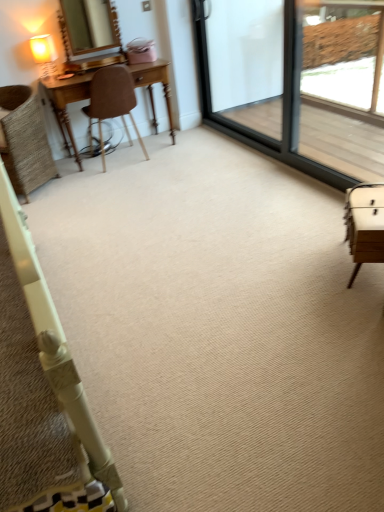
Question: Is brown leather chair at left, arranged as the 1th chair when viewed from the right, to the right of matte gold mirror at upper left from the viewer's perspective?

Choices:
 (A) yes
 (B) no

Answer: (A)

Question: Can you confirm if brown leather chair at left, placed as the 2th chair when sorted from left to right, is bigger than matte gold mirror at upper left?

Choices:
 (A) yes
 (B) no

Answer: (A)

Question: From the image's perspective, is brown leather chair at left, placed as the 2th chair when sorted from left to right, on top of matte gold mirror at upper left?

Choices:
 (A) yes
 (B) no

Answer: (B)

Question: Could you tell me if brown leather chair at left, arranged as the 1th chair when viewed from the right, is facing matte gold mirror at upper left?

Choices:
 (A) yes
 (B) no

Answer: (B)

Question: From the image's perspective, does brown leather chair at left, arranged as the 1th chair when viewed from the right, appear lower than matte gold mirror at upper left?

Choices:
 (A) no
 (B) yes

Answer: (B)

Question: In the image, is matte cream table lamp at upper left positioned in front of or behind transparent glass screen door at upper right, positioned as the 1th screen door in left-to-right order?

Choices:
 (A) front
 (B) behind

Answer: (B)

Question: Considering the positions of matte cream table lamp at upper left and transparent glass screen door at upper right, which appears as the second screen door when viewed from the right, in the image, is matte cream table lamp at upper left taller or shorter than transparent glass screen door at upper right, which appears as the second screen door when viewed from the right,?

Choices:
 (A) short
 (B) tall

Answer: (A)

Question: Is matte cream table lamp at upper left spatially inside transparent glass screen door at upper right, which appears as the second screen door when viewed from the right, or outside of it?

Choices:
 (A) inside
 (B) outside

Answer: (B)

Question: Is matte cream table lamp at upper left bigger or smaller than transparent glass screen door at upper right, which appears as the second screen door when viewed from the right?

Choices:
 (A) small
 (B) big

Answer: (A)

Question: Would you say matte cream table lamp at upper left is inside or outside brown leather chair at left, arranged as the 1th chair when viewed from the right?

Choices:
 (A) outside
 (B) inside

Answer: (A)

Question: Is matte cream table lamp at upper left to the left or to the right of brown leather chair at left, arranged as the 1th chair when viewed from the right, in the image?

Choices:
 (A) right
 (B) left

Answer: (B)

Question: Is matte cream table lamp at upper left taller or shorter than brown leather chair at left, placed as the 2th chair when sorted from left to right?

Choices:
 (A) tall
 (B) short

Answer: (B)

Question: Is point (33, 38) positioned closer to the camera than point (119, 65)?

Choices:
 (A) farther
 (B) closer

Answer: (A)

Question: From their relative heights in the image, would you say matte gold mirror at upper left is taller or shorter than woven wicker chair at left, the 1th chair viewed from the left?

Choices:
 (A) short
 (B) tall

Answer: (A)

Question: Is matte gold mirror at upper left situated inside woven wicker chair at left, the second chair positioned from the right, or outside?

Choices:
 (A) outside
 (B) inside

Answer: (A)